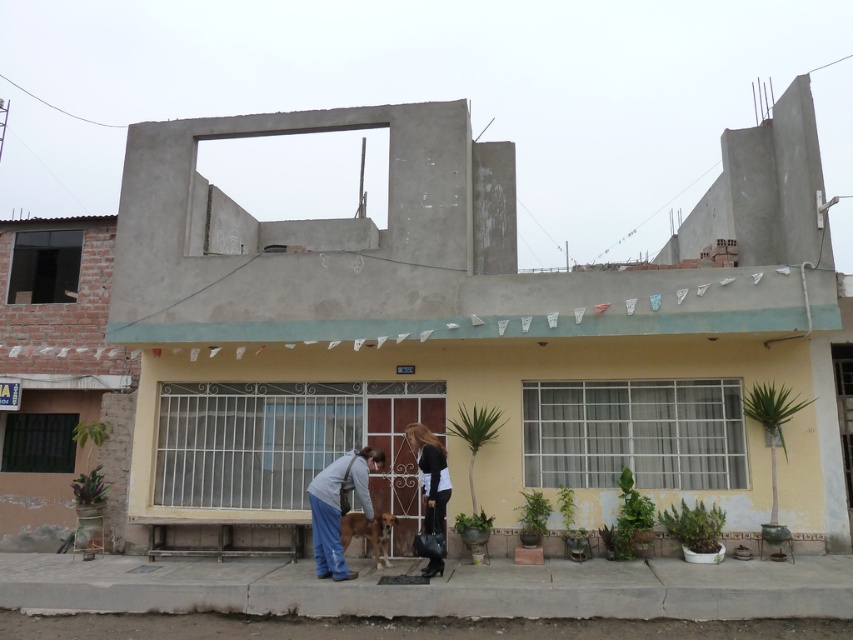
You are a delivery person standing outside the building. You need to determine if the blue jeans at center and the brown fur dog at center can both fit through a doorway that is 1.5 meters wide. Can they?

The blue jeans at center is taller than the brown fur dog at center, but their widths are not specified. Since the doorway is 1.5 meters wide, if both can fit side by side within that width, they can pass together. However, without knowing their individual widths, it is impossible to confirm.

You are a visitor approaching the building and see the dark brown hair at center and the brown fur dog at center. Which one is higher up in the scene?

The dark brown hair at center is located above the brown fur dog at center, so the dark brown hair at center is higher up in the scene.

Based on the photo, you are a photographer standing in front of the building. You notice two people in the scene. One is wearing blue jeans at center and the other has dark brown hair at center. Which person is taller?

The blue jeans at center has a greater height compared to dark brown hair at center, so the person wearing blue jeans at center is taller.